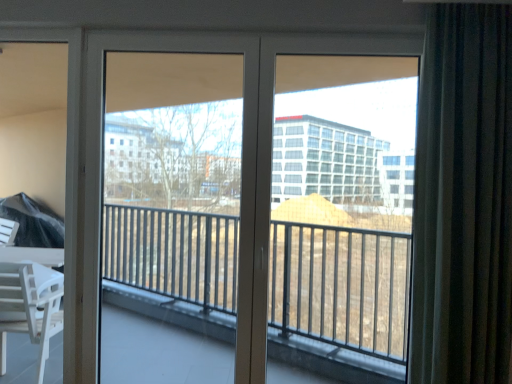
Question: From the image's perspective, does clear glass screen door at center appear lower than dark gray textured curtain at right?

Choices:
 (A) yes
 (B) no

Answer: (A)

Question: Is clear glass screen door at center positioned with its back to dark gray textured curtain at right?

Choices:
 (A) yes
 (B) no

Answer: (B)

Question: Does clear glass screen door at center contain dark gray textured curtain at right?

Choices:
 (A) yes
 (B) no

Answer: (B)

Question: Is clear glass screen door at center smaller than dark gray textured curtain at right?

Choices:
 (A) yes
 (B) no

Answer: (A)

Question: Is clear glass screen door at center at the left side of dark gray textured curtain at right?

Choices:
 (A) yes
 (B) no

Answer: (A)

Question: Does clear glass screen door at center turn towards dark gray textured curtain at right?

Choices:
 (A) no
 (B) yes

Answer: (A)

Question: Is clear glass screen door at center to the left of white glossy door at center from the viewer's perspective?

Choices:
 (A) yes
 (B) no

Answer: (A)

Question: Is clear glass screen door at center thinner than white glossy door at center?

Choices:
 (A) no
 (B) yes

Answer: (B)

Question: Is clear glass screen door at center taller than white glossy door at center?

Choices:
 (A) yes
 (B) no

Answer: (B)

Question: Is there a large distance between clear glass screen door at center and white glossy door at center?

Choices:
 (A) yes
 (B) no

Answer: (B)

Question: From the image's perspective, is clear glass screen door at center on white glossy door at center?

Choices:
 (A) yes
 (B) no

Answer: (A)

Question: From a real-world perspective, is clear glass screen door at center on white glossy door at center?

Choices:
 (A) no
 (B) yes

Answer: (A)

Question: Is dark gray textured curtain at right next to white glossy door at center and touching it?

Choices:
 (A) no
 (B) yes

Answer: (A)